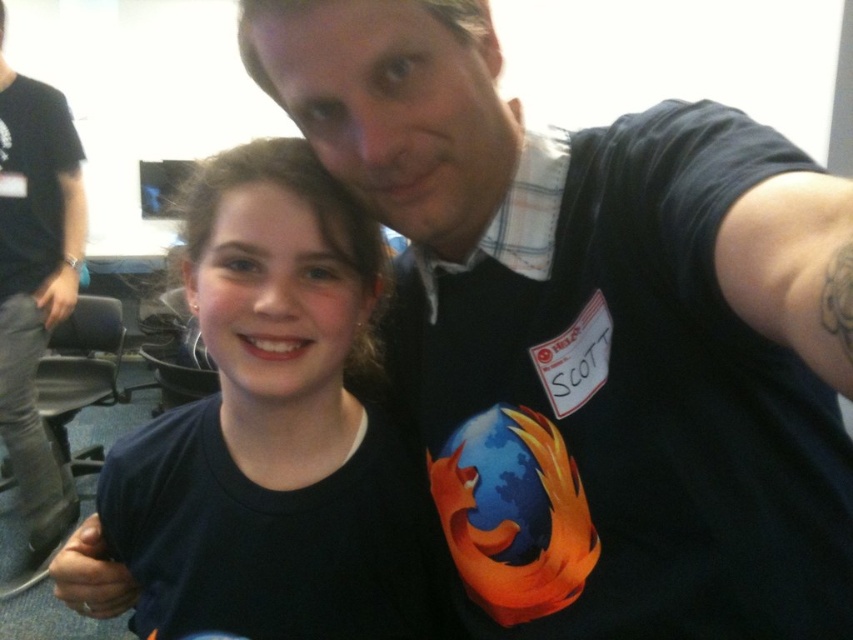
Question: Is black matte t-shirt at upper center smaller than black fabric arm at left?

Choices:
 (A) yes
 (B) no

Answer: (B)

Question: Which of these objects is positioned farthest from the plaid fabric shirt at upper center?

Choices:
 (A) black fabric arm at left
 (B) black t-shirt at upper right
 (C) black matte t-shirt at upper center
 (D) dark blue t-shirt at center

Answer: (B)

Question: Does black matte t-shirt at upper center have a greater width compared to dark blue t-shirt at center?

Choices:
 (A) no
 (B) yes

Answer: (B)

Question: Can you confirm if black matte t-shirt at upper center is positioned above plaid fabric shirt at upper center?

Choices:
 (A) yes
 (B) no

Answer: (B)

Question: Which point is farther to the camera?

Choices:
 (A) dark blue t-shirt at center
 (B) black t-shirt at upper right

Answer: (B)

Question: Which point appears closest to the camera in this image?

Choices:
 (A) (27, 500)
 (B) (279, 506)
 (C) (694, 259)

Answer: (C)